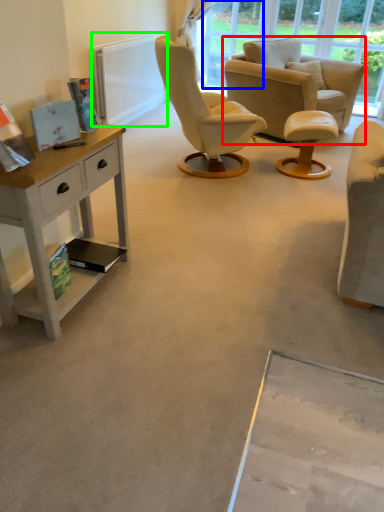
Question: Estimate the real-world distances between objects in this image. Which object is closer to chair (highlighted by a red box), window screen (highlighted by a blue box) or radiator (highlighted by a green box)?

Choices:
 (A) window screen
 (B) radiator

Answer: (A)